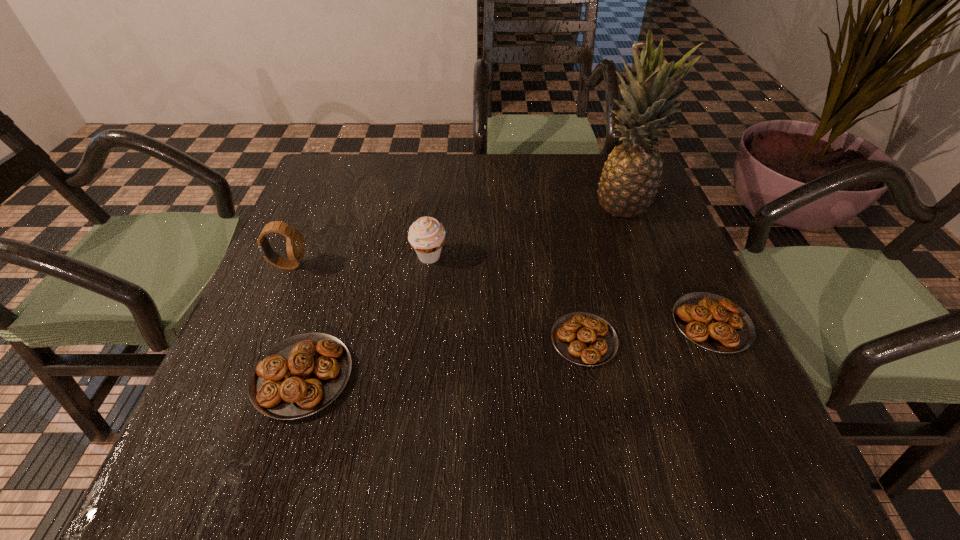
Where is `the leftmost pastry`? the leftmost pastry is located at coordinates (299, 376).

Identify the location of the shortest pastry. (583, 338).

Locate an element on the screen. This screenshot has width=960, height=540. the shortest object is located at coordinates (583, 338).

Find the location of a particular element. Image resolution: width=960 pixels, height=540 pixels. the rightmost pastry is located at coordinates (713, 322).

At what (x,y) coordinates should I click in order to perform the action: click on the second shortest object. Please return your answer as a coordinate pair (x, y). Looking at the image, I should click on (713, 322).

You are a GUI agent. You are given a task and a screenshot of the screen. Output one action in this format:
    pyautogui.click(x=<x>, y=<y>)
    Task: Click on the tallest object
    
    Given the screenshot: What is the action you would take?
    pyautogui.click(x=629, y=182)

At what (x,y) coordinates should I click in order to perform the action: click on the farthest object. Please return your answer as a coordinate pair (x, y). The image size is (960, 540). Looking at the image, I should click on (629, 182).

You are a GUI agent. You are given a task and a screenshot of the screen. Output one action in this format:
    pyautogui.click(x=<x>, y=<y>)
    Task: Click on the watch
    Image resolution: width=960 pixels, height=540 pixels.
    Given the screenshot: What is the action you would take?
    pyautogui.click(x=295, y=246)

I want to click on the third object from left to right, so click(x=426, y=235).

The image size is (960, 540). I want to click on free space located on the right of the leftmost pastry, so click(460, 376).